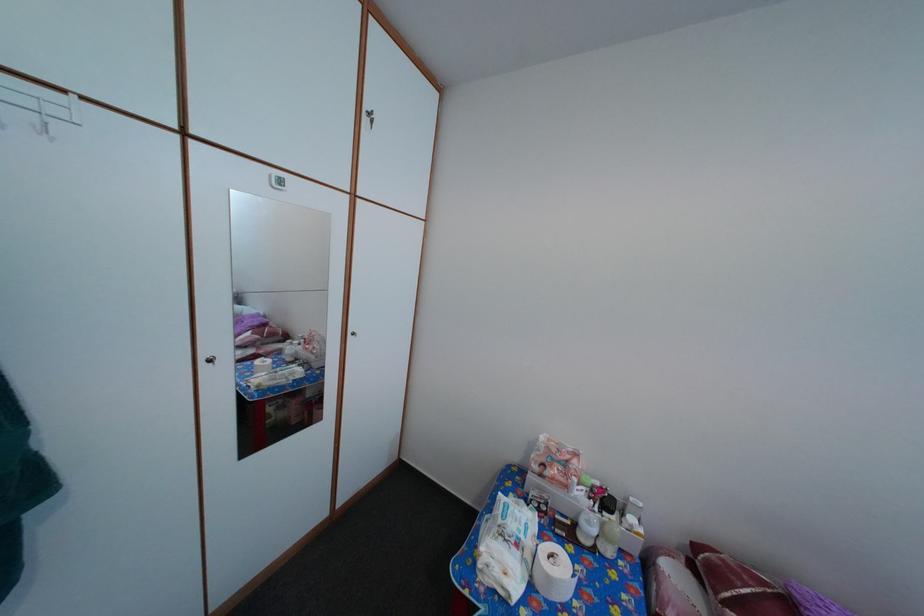
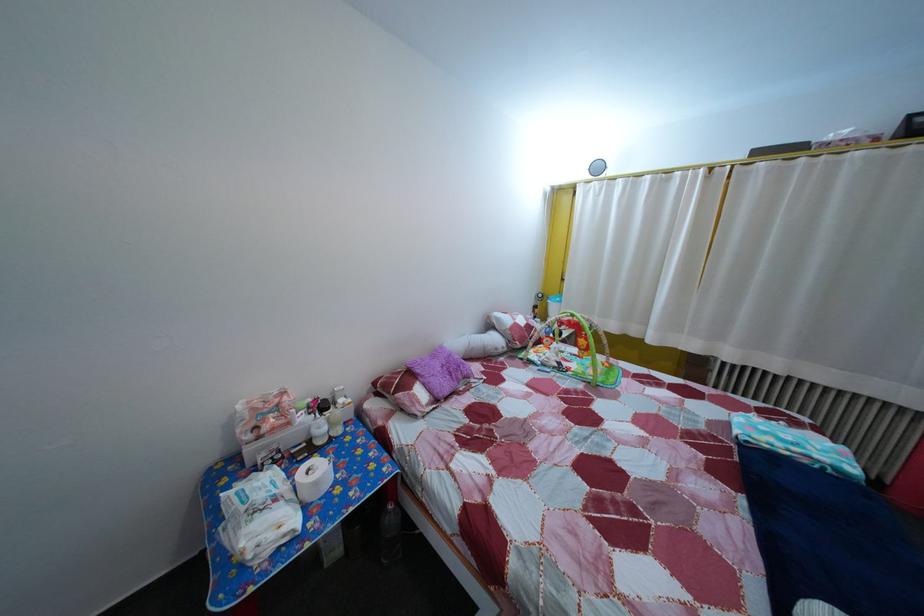
Where in the second image is the point corresponding to the point at 589,503 from the first image?

(311, 427)